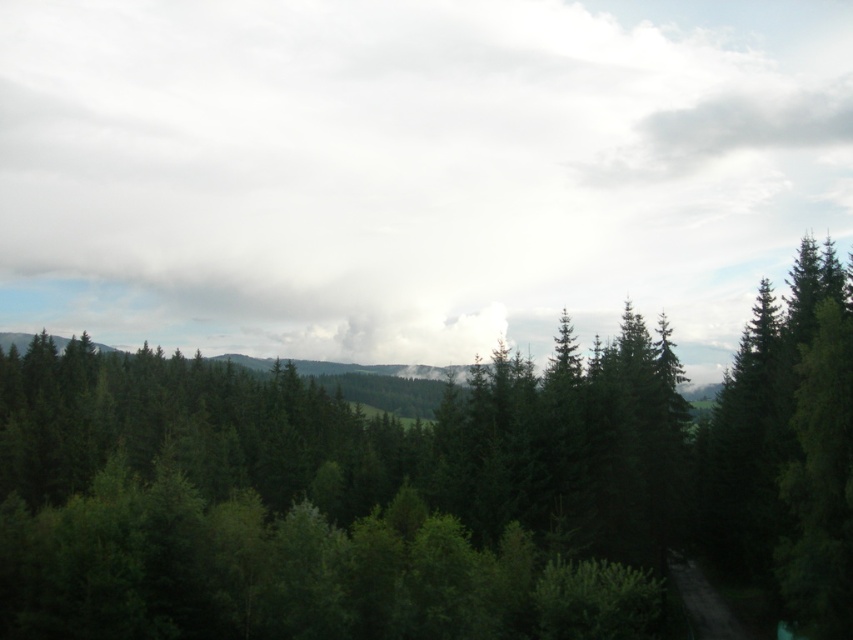
Question: Which of the following is the farthest from the observer?

Choices:
 (A) green matte tree at center
 (B) white fluffy cloud at upper center

Answer: (B)

Question: Which of the following is the farthest from the observer?

Choices:
 (A) (741, 323)
 (B) (137, 524)

Answer: (A)

Question: Is white fluffy cloud at upper center to the left of green matte tree at center from the viewer's perspective?

Choices:
 (A) no
 (B) yes

Answer: (B)

Question: In this image, where is white fluffy cloud at upper center located relative to green matte tree at center?

Choices:
 (A) right
 (B) left

Answer: (B)

Question: Which of the following is the farthest from the observer?

Choices:
 (A) (350, 230)
 (B) (207, 614)

Answer: (A)

Question: Does white fluffy cloud at upper center appear over green matte tree at center?

Choices:
 (A) no
 (B) yes

Answer: (B)